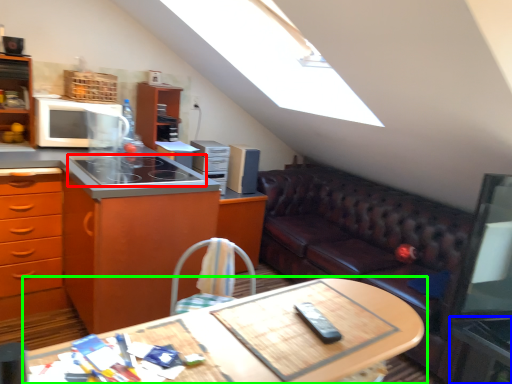
Question: Which is farther away from gas stove (highlighted by a red box)? side table (highlighted by a blue box) or table (highlighted by a green box)?

Choices:
 (A) side table
 (B) table

Answer: (A)